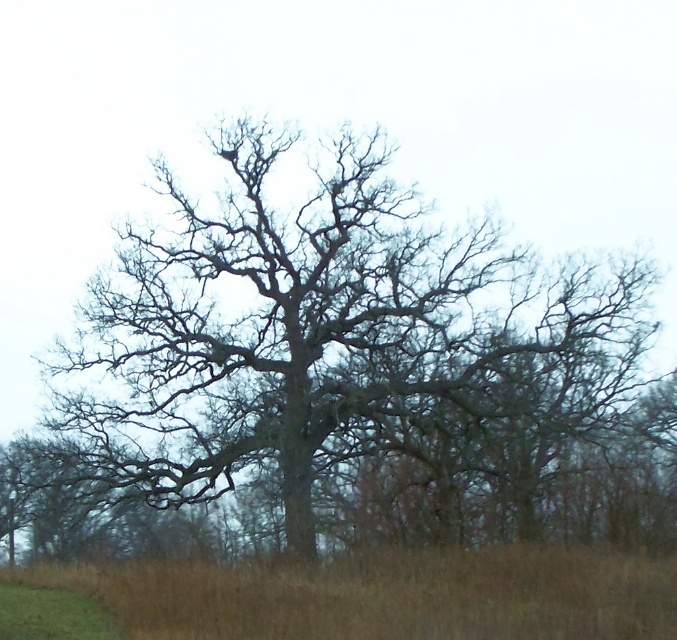
Looking at this image, you are standing at the point marked at coordinates point (659, 416). You want to walk straight ahead to a point that is 47.73 meters away. Will you be able to see the large leafless tree dominating the center of the frame in your path?

Since you are at point (659, 416) and the large leafless tree dominating the center of the frame is 47.73 meters away from you, you will be able to see the large leafless tree dominating the center of the frame in your path as you walk straight ahead.

You are standing in a field and see the bare wood tree at center. If you want to walk directly towards the tree, which direction should you face?

Since the bare wood tree at center is located at coordinates approximately 0.586 on the x axis and 0.524 on the y axis, you should face towards the center of the image to walk directly towards it.